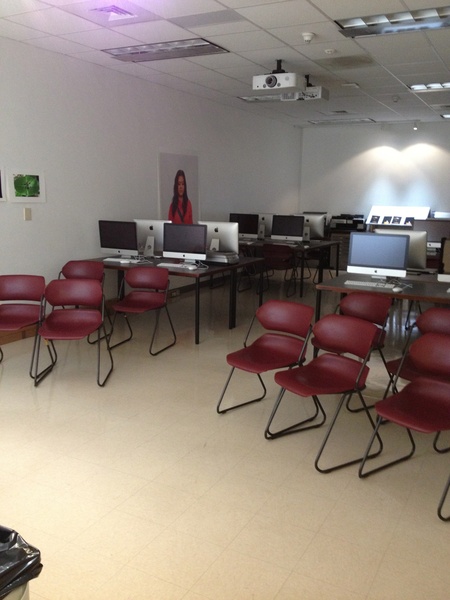
The height and width of the screenshot is (600, 450). In order to click on chairs in this screenshot , I will do `click(322, 366)`.